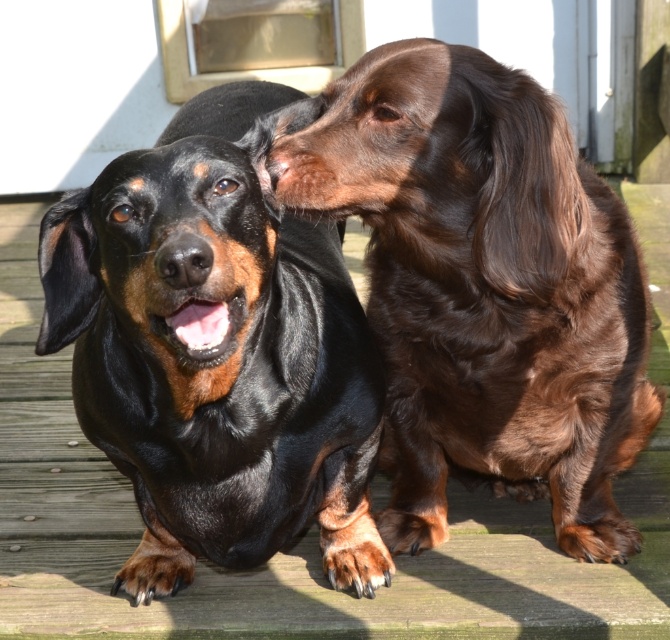
Question: Is shiny brown fur at center positioned before black shiny fur dog at center?

Choices:
 (A) no
 (B) yes

Answer: (A)

Question: Is shiny brown fur at center further to camera compared to black shiny fur dog at center?

Choices:
 (A) no
 (B) yes

Answer: (B)

Question: Which object is farther from the camera taking this photo?

Choices:
 (A) shiny brown fur at center
 (B) black shiny fur dog at center

Answer: (A)

Question: Which point is closer to the camera?

Choices:
 (A) shiny brown fur at center
 (B) black shiny fur dog at center

Answer: (B)

Question: Does shiny brown fur at center have a lesser width compared to black shiny fur dog at center?

Choices:
 (A) no
 (B) yes

Answer: (A)